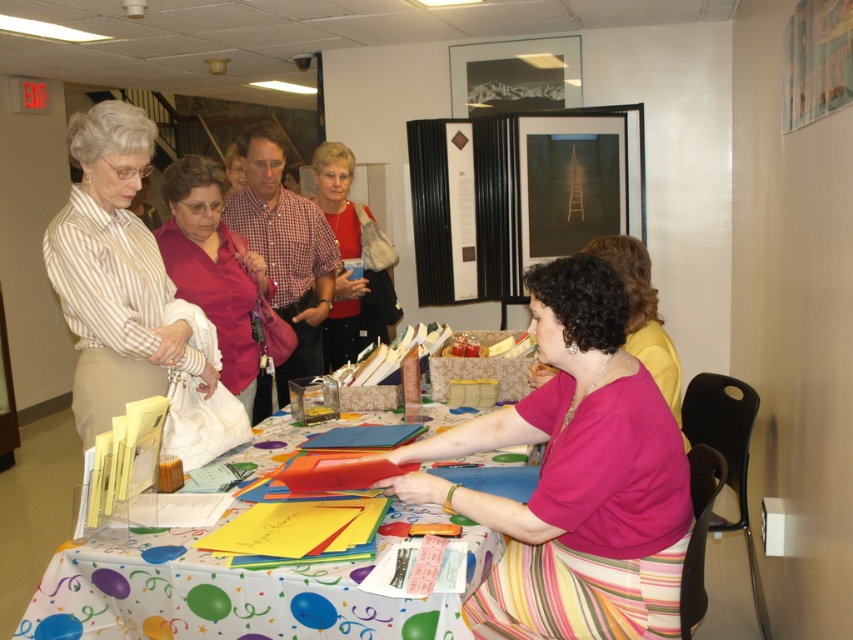
Does matte pink blouse at center come in front of pink matte shirt at center?

That is False.

Is point (236, 340) farther from viewer compared to point (675, 412)?

Yes, it is behind point (675, 412).

Who is more distant from viewer, (177, 205) or (639, 348)?

The point (177, 205) is behind.

The height and width of the screenshot is (640, 853). Identify the location of matte pink blouse at center. (213, 269).

Which is in front, point (277, 582) or point (625, 266)?

Point (277, 582) is more forward.

Does balloon-patterned paper at center come behind pink matte shirt at center?

That is False.

Locate an element on the screen. This screenshot has height=640, width=853. balloon-patterned paper at center is located at coordinates (215, 596).

Who is positioned more to the left, pink fabric skirt at lower center or striped fabric blouse at left?

Positioned to the left is striped fabric blouse at left.

Who is more forward, (x=585, y=358) or (x=51, y=264)?

Point (x=585, y=358)

Identify the location of pink fabric skirt at lower center. (575, 477).